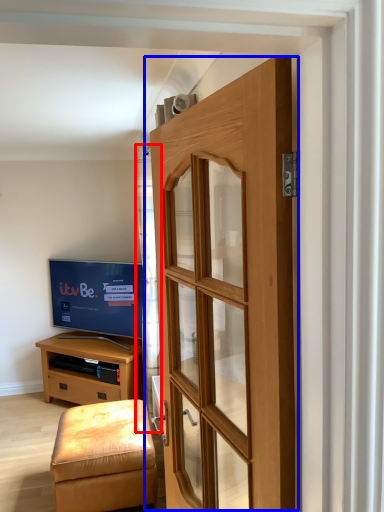
Question: Among these objects, which one is farthest to the camera, curtain (highlighted by a red box) or door (highlighted by a blue box)?

Choices:
 (A) curtain
 (B) door

Answer: (A)